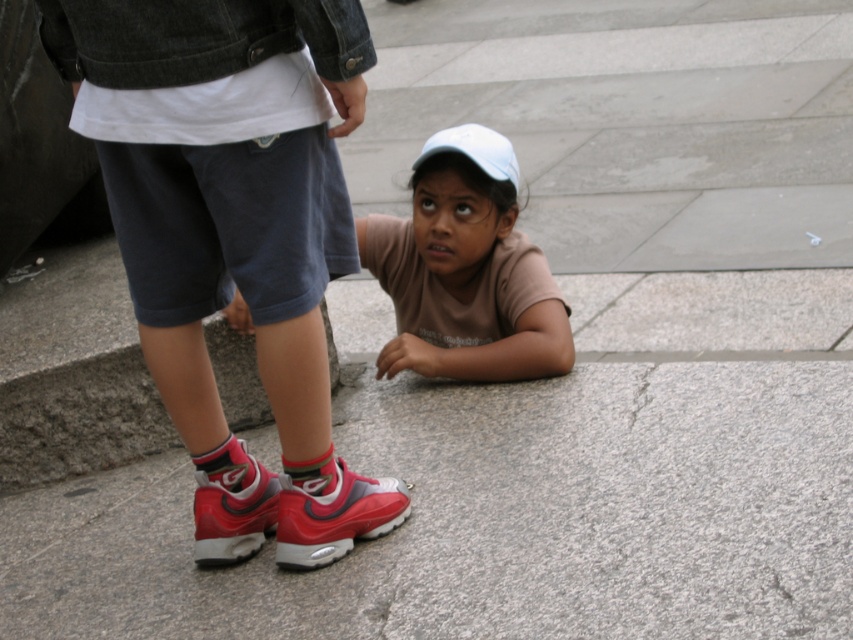
Question: Is pink fabric sock at lower left further to the viewer compared to gray cotton sock at lower center?

Choices:
 (A) no
 (B) yes

Answer: (B)

Question: Can you confirm if matte red sneakers at lower left is positioned below pink fabric sock at lower left?

Choices:
 (A) yes
 (B) no

Answer: (B)

Question: Can you confirm if brown cotton shirt at lower center is positioned to the left of white matte baseball cap at lower center?

Choices:
 (A) no
 (B) yes

Answer: (B)

Question: Considering the real-world distances, which object is farthest from the brown cotton shirt at lower center?

Choices:
 (A) white matte baseball cap at lower center
 (B) shiny red sneaker at lower center

Answer: (B)

Question: Estimate the real-world distances between objects in this image. Which object is closer to the shiny red sneaker at lower left?

Choices:
 (A) gray granite pavement at lower center
 (B) shiny red sneaker at lower center
 (C) white matte baseball cap at lower center
 (D) matte red sneakers at lower left

Answer: (B)

Question: Which point is farther to the camera?

Choices:
 (A) pink fabric sock at lower left
 (B) brown cotton shirt at lower center
 (C) shiny red sneaker at lower left
 (D) gray granite pavement at lower center

Answer: (B)